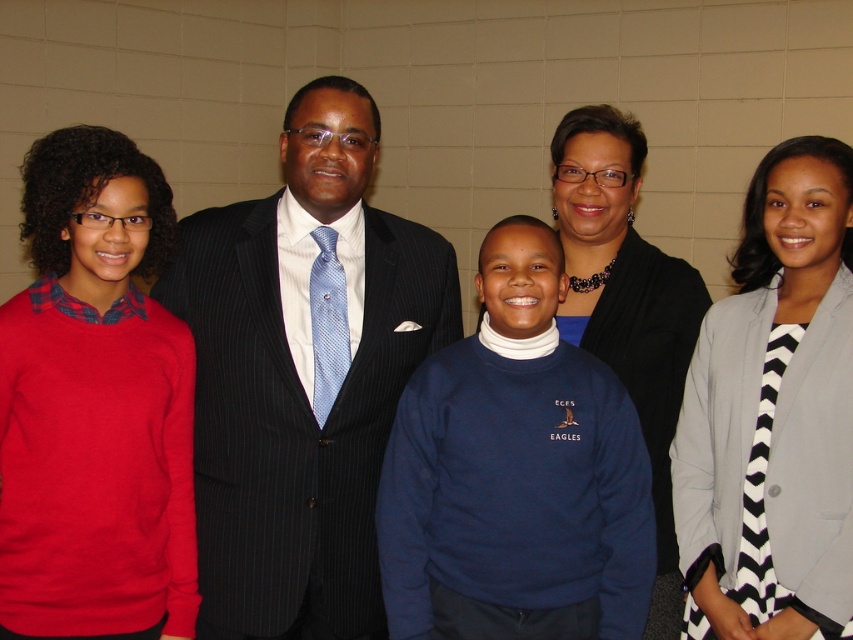
Question: Considering the relative positions of pinstriped suit at center and navy blue sweater at center in the image provided, where is pinstriped suit at center located with respect to navy blue sweater at center?

Choices:
 (A) above
 (B) below

Answer: (A)

Question: Which object is the closest to the gray wool blazer at center?

Choices:
 (A) pinstriped suit at center
 (B) black matte sweater at center
 (C) navy blue sweater at center

Answer: (B)

Question: Can you confirm if pinstriped suit at center is positioned below black matte sweater at center?

Choices:
 (A) yes
 (B) no

Answer: (B)

Question: Is gray wool blazer at center to the left of black matte sweater at center from the viewer's perspective?

Choices:
 (A) yes
 (B) no

Answer: (B)

Question: Which point appears closest to the camera in this image?

Choices:
 (A) (828, 337)
 (B) (352, 253)

Answer: (A)

Question: Which of the following is the closest to the observer?

Choices:
 (A) (639, 326)
 (B) (531, 324)

Answer: (B)